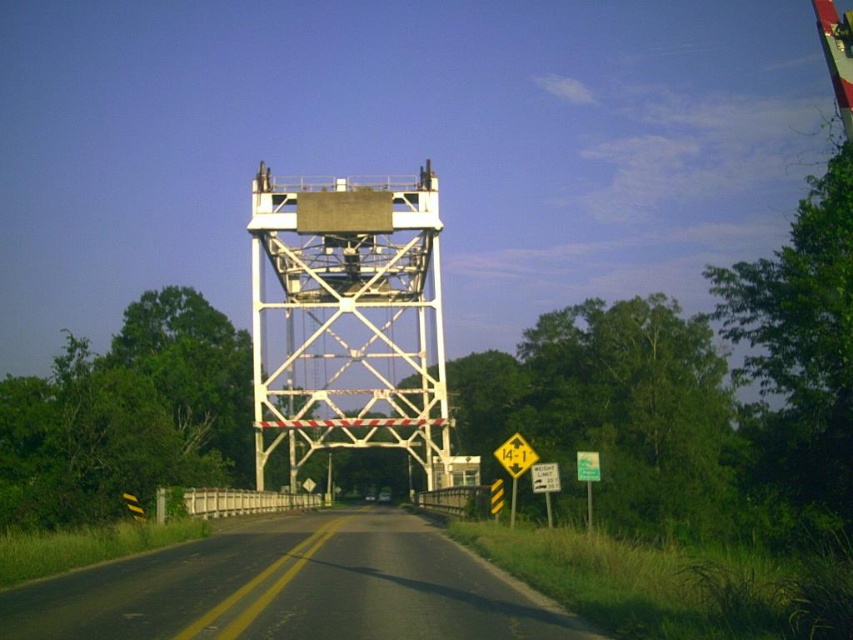
The height and width of the screenshot is (640, 853). Identify the location of black asphalt road at center. (293, 588).

Who is more distant from viewer, (x=80, y=620) or (x=598, y=456)?

The point (x=598, y=456) is more distant.

Identify the location of black asphalt road at center. (293, 588).

Can you confirm if yellow reflective plastic triangle at center is thinner than green plastic sign at lower right?

Indeed, yellow reflective plastic triangle at center has a lesser width compared to green plastic sign at lower right.

Does yellow reflective plastic triangle at center have a greater height compared to green plastic sign at lower right?

No.

Is point (495, 454) positioned behind point (579, 476)?

Yes, point (495, 454) is behind point (579, 476).

Locate an element on the screen. yellow reflective plastic triangle at center is located at coordinates (515, 456).

Which is behind, point (370, 321) or point (579, 461)?

The point (370, 321) is more distant.

Who is more forward, [335,401] or [577,468]?

Point [577,468] is more forward.

What do you see at coordinates (347, 321) in the screenshot? The width and height of the screenshot is (853, 640). I see `white metallic tower at center` at bounding box center [347, 321].

The height and width of the screenshot is (640, 853). I want to click on white metallic tower at center, so click(347, 321).